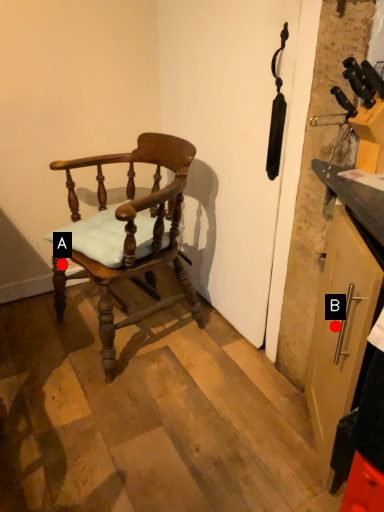
Question: Two points are circled on the image, labeled by A and B beside each circle. Among these points, which one is nearest to the camera?

Choices:
 (A) A is closer
 (B) B is closer

Answer: (B)